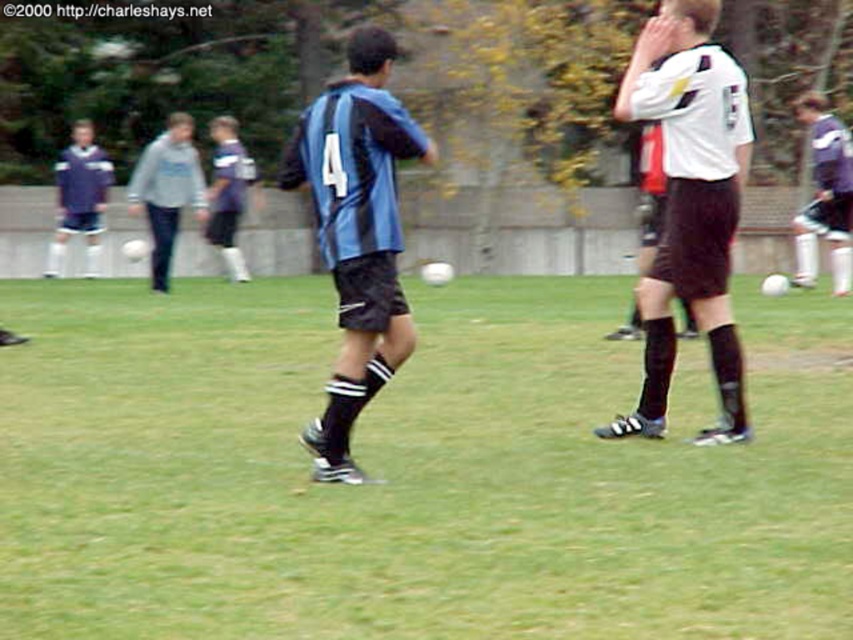
Question: Which of the following is the closest to the observer?

Choices:
 (A) matte blue jersey at left
 (B) green grass at center
 (C) blue jersey at center

Answer: (B)

Question: Can you confirm if green grass at center is positioned to the left of matte blue jersey at left?

Choices:
 (A) yes
 (B) no

Answer: (B)

Question: Does white matte jersey at center lie in front of gray fleece jacket at center?

Choices:
 (A) no
 (B) yes

Answer: (B)

Question: Among these points, which one is nearest to the camera?

Choices:
 (A) (697, 97)
 (B) (177, 186)
 (C) (100, 205)

Answer: (A)

Question: Which is farther from the white matte jersey at center?

Choices:
 (A) green grass at center
 (B) blue jersey at center
 (C) gray fleece jacket at center
 (D) blue matte jersey at center

Answer: (B)

Question: Is blue matte jersey at center above blue jersey at center?

Choices:
 (A) yes
 (B) no

Answer: (B)